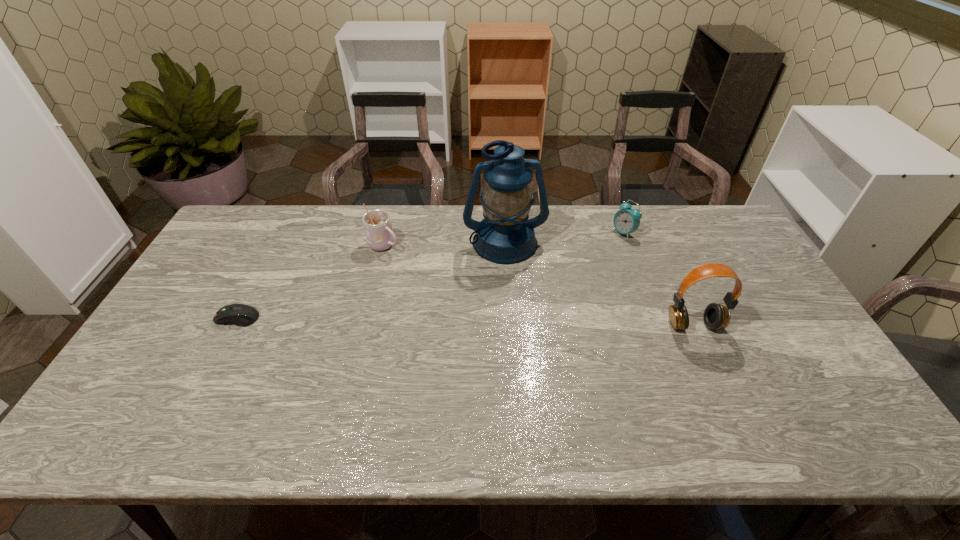
Point out which object is positioned as the nearest to the fourth tallest object. Please provide its 2D coordinates. Your answer should be formatted as a tuple, i.e. [(x, y)], where the tuple contains the x and y coordinates of a point satisfying the conditions above.

[(505, 236)]

What are the coordinates of `blank area in the image that satisfies the following two spatial constraints: 1. on the back side of the alarm clock; 2. on the right side of the lantern` in the screenshot? It's located at (504, 233).

What are the coordinates of `free space that satisfies the following two spatial constraints: 1. on the back side of the tallest object; 2. on the left side of the second object from left to right` in the screenshot? It's located at (385, 242).